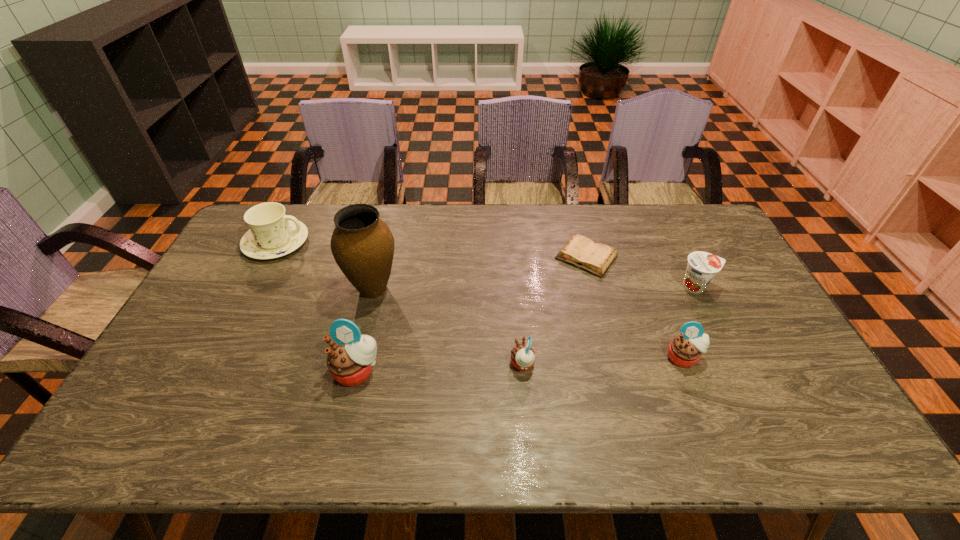
At what (x,y) coordinates should I click in order to perform the action: click on vacant space that satisfies the following two spatial constraints: 1. on the handle side of the shortest object; 2. on the left side of the leftmost object. Please return your answer as a coordinate pair (x, y). Image resolution: width=960 pixels, height=540 pixels. Looking at the image, I should click on (269, 257).

Where is `free space that satisfies the following two spatial constraints: 1. on the front-facing side of the sixth object from left to right; 2. on the front-facing side of the shortest muffin`? This screenshot has width=960, height=540. free space that satisfies the following two spatial constraints: 1. on the front-facing side of the sixth object from left to right; 2. on the front-facing side of the shortest muffin is located at coordinates [686, 364].

Locate an element on the screen. The height and width of the screenshot is (540, 960). free region that satisfies the following two spatial constraints: 1. on the back side of the yogurt; 2. on the right side of the tallest object is located at coordinates (374, 287).

Locate an element on the screen. Image resolution: width=960 pixels, height=540 pixels. free location that satisfies the following two spatial constraints: 1. on the handle side of the leftmost object; 2. on the back side of the yogurt is located at coordinates (253, 287).

This screenshot has width=960, height=540. Find the location of `vacant area that satisfies the following two spatial constraints: 1. on the handle side of the rightmost object; 2. on the right side of the chinaware`. vacant area that satisfies the following two spatial constraints: 1. on the handle side of the rightmost object; 2. on the right side of the chinaware is located at coordinates (253, 287).